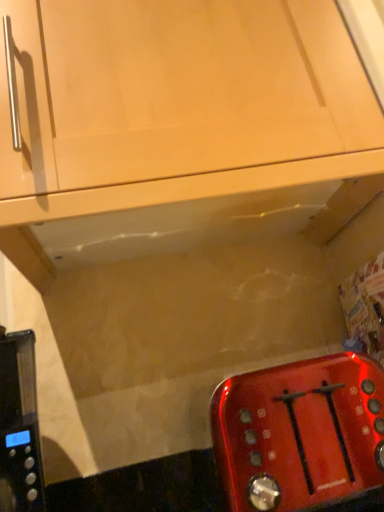
What is the approximate height of matte wood cabinet at upper center?

matte wood cabinet at upper center is 32.89 inches in height.

Measure the distance between matte wood cabinet at upper center and camera.

A distance of 21.85 inches exists between matte wood cabinet at upper center and camera.

Locate an element on the screen. matte wood cabinet at upper center is located at coordinates (179, 103).

What is the approximate width of matte wood cabinet at upper center?

matte wood cabinet at upper center is 18.51 inches in width.

The height and width of the screenshot is (512, 384). What do you see at coordinates (179, 103) in the screenshot?
I see `matte wood cabinet at upper center` at bounding box center [179, 103].

Locate an element on the screen. shiny metallic toaster at lower right is located at coordinates (300, 433).

Describe the element at coordinates (300, 433) in the screenshot. The width and height of the screenshot is (384, 512). I see `shiny metallic toaster at lower right` at that location.

You are a GUI agent. You are given a task and a screenshot of the screen. Output one action in this format:
    pyautogui.click(x=<x>, y=<y>)
    Task: Click on the matte wood cabinet at upper center
    This screenshot has width=384, height=512.
    Given the screenshot: What is the action you would take?
    pyautogui.click(x=179, y=103)

Based on their positions, is matte wood cabinet at upper center located to the left or right of shiny metallic toaster at lower right?

Based on their positions, matte wood cabinet at upper center is located to the left of shiny metallic toaster at lower right.

Is the depth of matte wood cabinet at upper center greater than that of shiny metallic toaster at lower right?

Yes, it is.

Does point (168, 129) appear closer or farther from the camera than point (219, 458)?

Point (168, 129) appears to be closer to the viewer than point (219, 458).

From the image's perspective, relative to shiny metallic toaster at lower right, is matte wood cabinet at upper center above or below?

From the image's perspective, matte wood cabinet at upper center appears above shiny metallic toaster at lower right.

From a real-world perspective, is matte wood cabinet at upper center located beneath shiny metallic toaster at lower right?

Actually, matte wood cabinet at upper center is physically above shiny metallic toaster at lower right in the real world.

Considering the relative sizes of matte wood cabinet at upper center and shiny metallic toaster at lower right in the image provided, is matte wood cabinet at upper center thinner than shiny metallic toaster at lower right?

No, matte wood cabinet at upper center is not thinner than shiny metallic toaster at lower right.

Which of these two, matte wood cabinet at upper center or shiny metallic toaster at lower right, stands shorter?

shiny metallic toaster at lower right.

Looking at this image, considering the relative sizes of matte wood cabinet at upper center and shiny metallic toaster at lower right in the image provided, is matte wood cabinet at upper center bigger than shiny metallic toaster at lower right?

Indeed, matte wood cabinet at upper center has a larger size compared to shiny metallic toaster at lower right.

Is matte wood cabinet at upper center not within shiny metallic toaster at lower right?

Indeed, matte wood cabinet at upper center is completely outside shiny metallic toaster at lower right.

Is matte wood cabinet at upper center directly adjacent to shiny metallic toaster at lower right?

matte wood cabinet at upper center and shiny metallic toaster at lower right are not in contact.

Is matte wood cabinet at upper center oriented towards shiny metallic toaster at lower right?

No.

How many degrees apart are the facing directions of matte wood cabinet at upper center and shiny metallic toaster at lower right?

1.89 degrees separate the facing orientations of matte wood cabinet at upper center and shiny metallic toaster at lower right.

The height and width of the screenshot is (512, 384). Identify the location of cabinetry that is above the shiny metallic toaster at lower right (from a real-world perspective). (179, 103).

Is shiny metallic toaster at lower right at the right side of matte wood cabinet at upper center?

Correct, you'll find shiny metallic toaster at lower right to the right of matte wood cabinet at upper center.

Which is behind, shiny metallic toaster at lower right or matte wood cabinet at upper center?

matte wood cabinet at upper center is further from the camera.

Consider the image. Which point is more forward, (324, 499) or (53, 6)?

Positioned in front is point (53, 6).

From the image's perspective, between shiny metallic toaster at lower right and matte wood cabinet at upper center, which one is located above?

matte wood cabinet at upper center is shown above in the image.

From a real-world perspective, who is located higher, shiny metallic toaster at lower right or matte wood cabinet at upper center?

matte wood cabinet at upper center.

Is shiny metallic toaster at lower right wider than matte wood cabinet at upper center?

No, shiny metallic toaster at lower right is not wider than matte wood cabinet at upper center.

Which of these two, shiny metallic toaster at lower right or matte wood cabinet at upper center, stands taller?

matte wood cabinet at upper center is taller.

Is shiny metallic toaster at lower right smaller than matte wood cabinet at upper center?

Indeed, shiny metallic toaster at lower right has a smaller size compared to matte wood cabinet at upper center.

Is matte wood cabinet at upper center completely or partially inside shiny metallic toaster at lower right?

No, shiny metallic toaster at lower right does not contain matte wood cabinet at upper center.

Can you see shiny metallic toaster at lower right touching matte wood cabinet at upper center?

shiny metallic toaster at lower right and matte wood cabinet at upper center are clearly separated.

Does shiny metallic toaster at lower right turn towards matte wood cabinet at upper center?

No, shiny metallic toaster at lower right is not aimed at matte wood cabinet at upper center.

How many degrees apart are the facing directions of shiny metallic toaster at lower right and matte wood cabinet at upper center?

They differ by 1.89 degrees in their facing directions.

Where is `cabinetry behind the shiny metallic toaster at lower right`? This screenshot has height=512, width=384. cabinetry behind the shiny metallic toaster at lower right is located at coordinates (179, 103).

Identify the location of cabinetry above the shiny metallic toaster at lower right (from a real-world perspective). The image size is (384, 512). (179, 103).

Image resolution: width=384 pixels, height=512 pixels. In order to click on toaster below the matte wood cabinet at upper center (from the image's perspective) in this screenshot , I will do `click(300, 433)`.